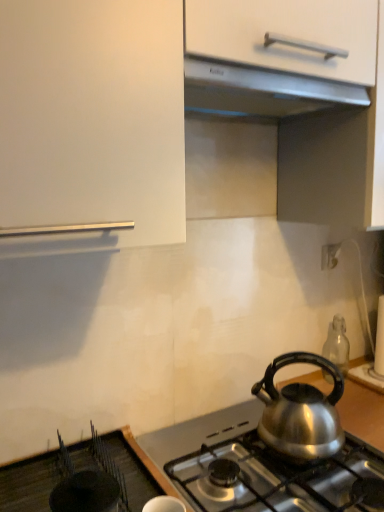
Question: From a real-world perspective, does satin silver exhaust hood at upper center sit lower than shiny metallic kettle at lower right?

Choices:
 (A) no
 (B) yes

Answer: (A)

Question: Is satin silver exhaust hood at upper center wider than shiny metallic kettle at lower right?

Choices:
 (A) no
 (B) yes

Answer: (B)

Question: Can you confirm if satin silver exhaust hood at upper center is positioned to the right of shiny metallic kettle at lower right?

Choices:
 (A) no
 (B) yes

Answer: (A)

Question: Is satin silver exhaust hood at upper center located outside shiny metallic kettle at lower right?

Choices:
 (A) yes
 (B) no

Answer: (A)

Question: Can shiny metallic kettle at lower right be found inside satin silver exhaust hood at upper center?

Choices:
 (A) no
 (B) yes

Answer: (A)

Question: In the image, is satin silver gas stove at lower center on the left side or the right side of satin silver exhaust hood at upper center?

Choices:
 (A) left
 (B) right

Answer: (B)

Question: Considering the positions of satin silver gas stove at lower center and satin silver exhaust hood at upper center in the image, is satin silver gas stove at lower center bigger or smaller than satin silver exhaust hood at upper center?

Choices:
 (A) small
 (B) big

Answer: (B)

Question: Is point (342, 457) positioned closer to the camera than point (238, 110)?

Choices:
 (A) farther
 (B) closer

Answer: (A)

Question: From a real-world perspective, is satin silver gas stove at lower center positioned above or below satin silver exhaust hood at upper center?

Choices:
 (A) below
 (B) above

Answer: (A)

Question: In terms of height, does satin silver exhaust hood at upper center look taller or shorter compared to white plastic electric outlet at upper right?

Choices:
 (A) short
 (B) tall

Answer: (A)

Question: Is satin silver exhaust hood at upper center inside or outside of white plastic electric outlet at upper right?

Choices:
 (A) outside
 (B) inside

Answer: (A)

Question: Is point (203, 103) closer or farther from the camera than point (321, 261)?

Choices:
 (A) farther
 (B) closer

Answer: (B)

Question: From the image's perspective, relative to white plastic electric outlet at upper right, is satin silver exhaust hood at upper center above or below?

Choices:
 (A) below
 (B) above

Answer: (B)

Question: Looking at the image, does satin silver exhaust hood at upper center seem bigger or smaller compared to transparent glass bottle at lower right?

Choices:
 (A) small
 (B) big

Answer: (B)

Question: Is satin silver exhaust hood at upper center inside the boundaries of transparent glass bottle at lower right, or outside?

Choices:
 (A) outside
 (B) inside

Answer: (A)